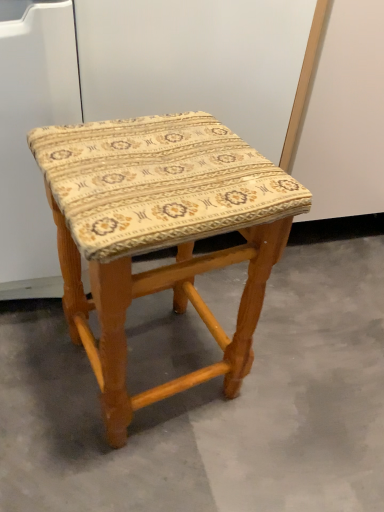
Identify the location of vacant region to the left of wooden stool at center. This screenshot has width=384, height=512. (38, 364).